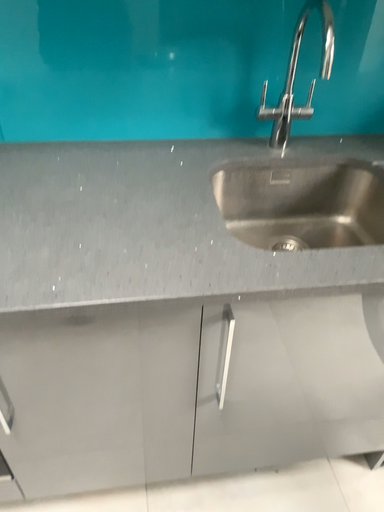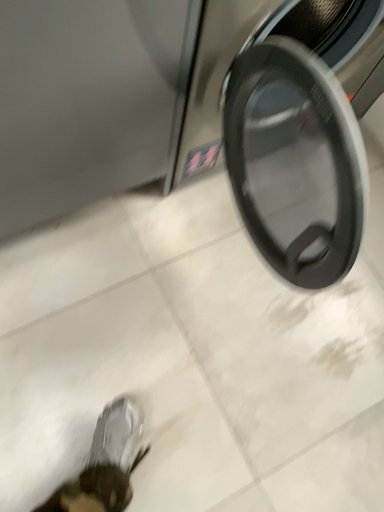
Question: How did the camera likely rotate when shooting the video?

Choices:
 (A) rotated right
 (B) rotated left

Answer: (A)